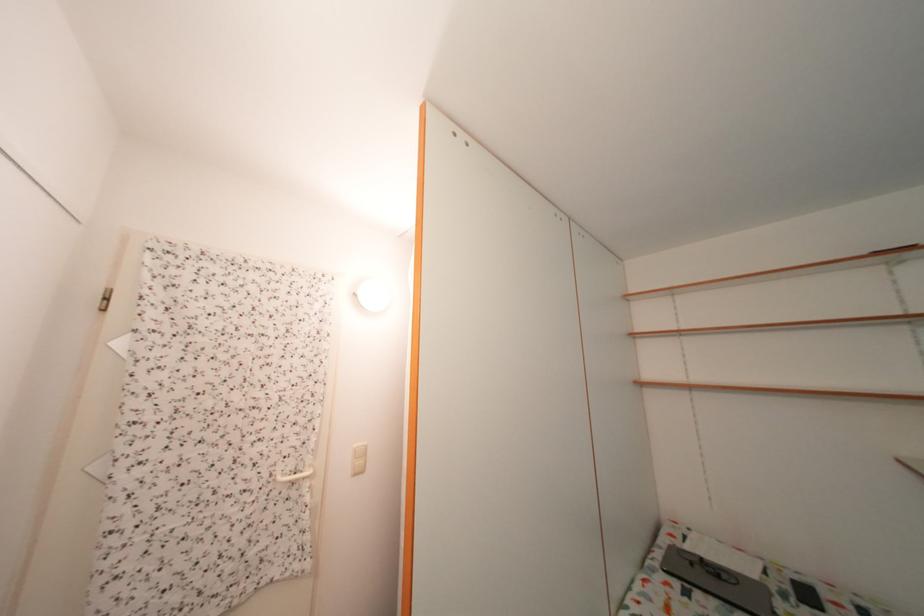
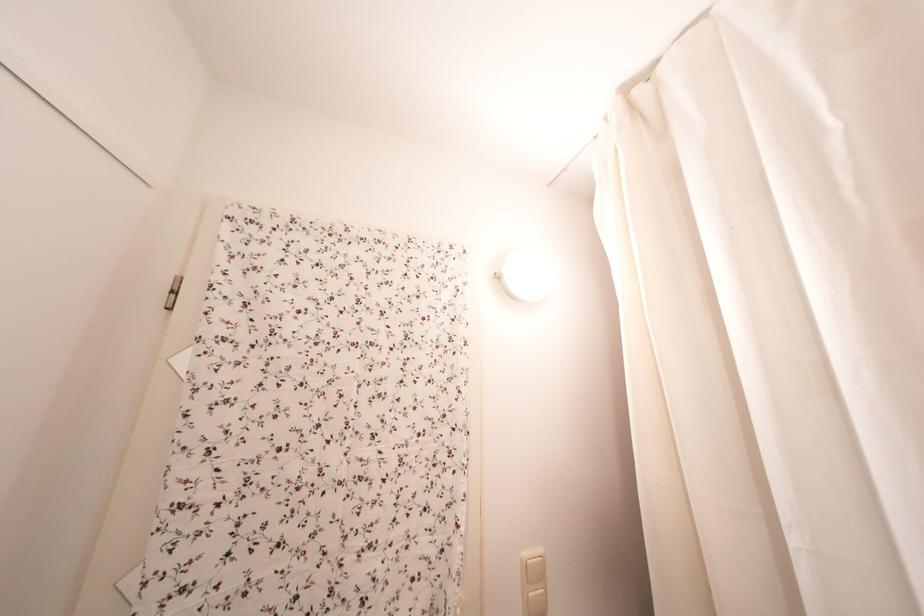
The images are taken continuously from a first-person perspective. In which direction are you moving?

The cameraman walked toward left, forward.